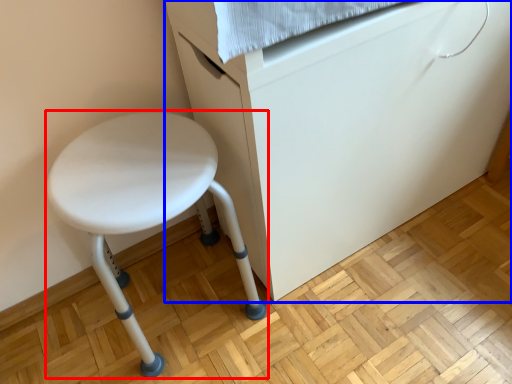
Question: Among these objects, which one is farthest to the camera, stool (highlighted by a red box) or furniture (highlighted by a blue box)?

Choices:
 (A) stool
 (B) furniture

Answer: (A)